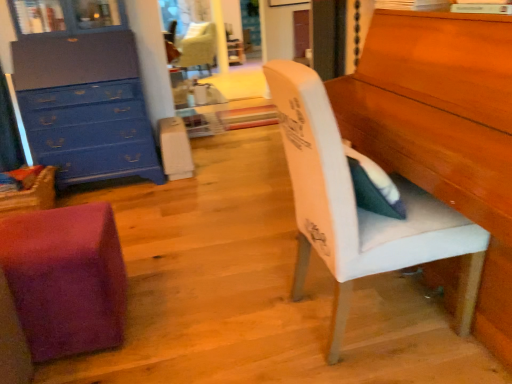
Find the location of `vacant space to the right of purple fuzzy cube at lower left, which is the 3th chair from top to bottom`. vacant space to the right of purple fuzzy cube at lower left, which is the 3th chair from top to bottom is located at coordinates (167, 323).